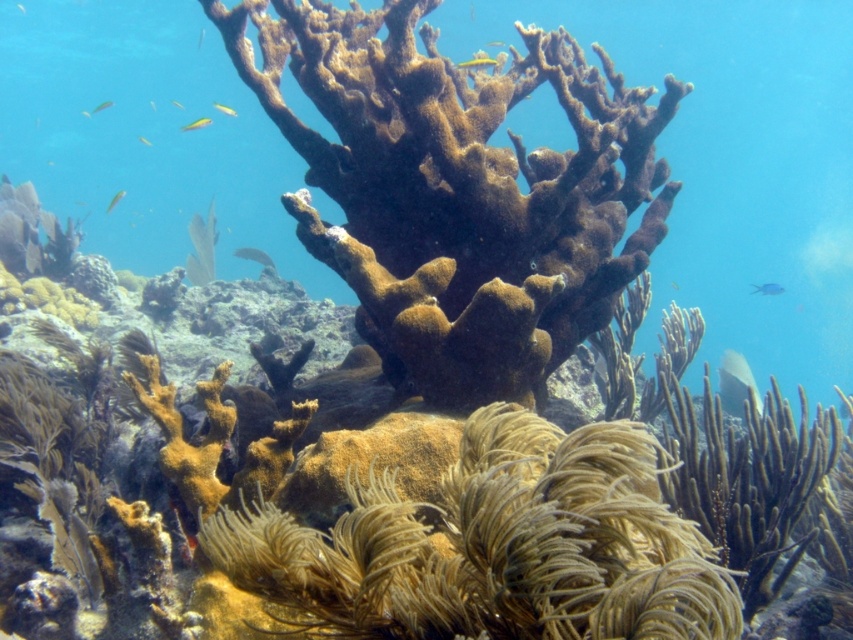
You are a scuba diver swimming underwater and want to take a photo of the brown coral at center and the yellow translucent fish at upper left. If your camera has a maximum focus range of 15 feet, will you be able to capture both subjects in one clear shot?

The brown coral at center is 17.30 feet away from the yellow translucent fish at upper left. Since the camera can only focus up to 15 feet, the distance between them exceeds the maximum range. Therefore, you cannot capture both subjects in one clear shot.

You are a scuba diver swimming in this underwater scene. You notice two points marked in the image. Point A is at coordinates point (728, 364) and Point B is at point (254, 248). If you want to reach the point that is closer to you, which point should you swim towards?

Point A at point (728, 364) is in front of point B at point (254, 248), so you should swim towards Point A to reach the closer one.